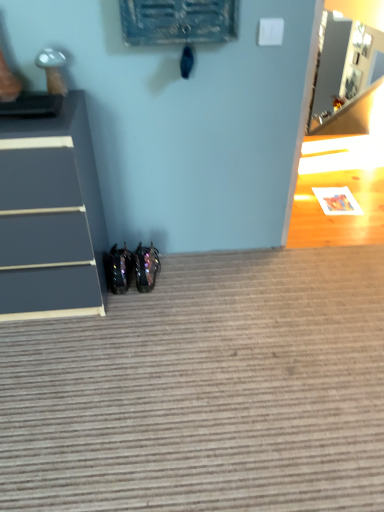
Identify the location of free space in front of glossy metallic shoes at lower center, placed as the 1th footwear when sorted from right to left. This screenshot has width=384, height=512. (149, 304).